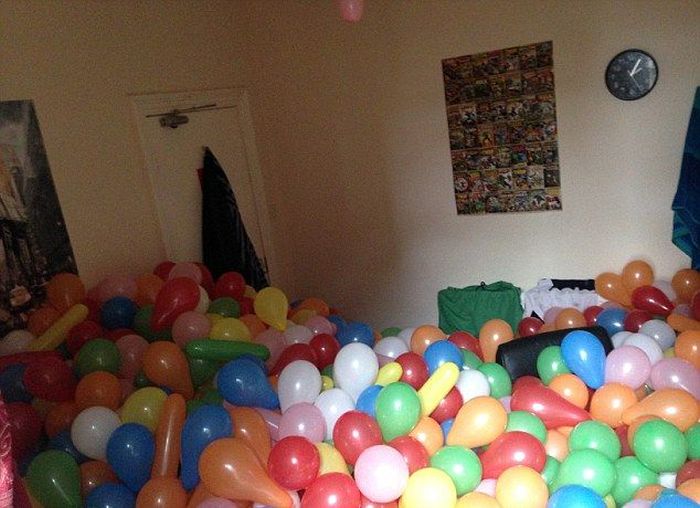
The image size is (700, 508). Find the location of `clock`. clock is located at coordinates (629, 78).